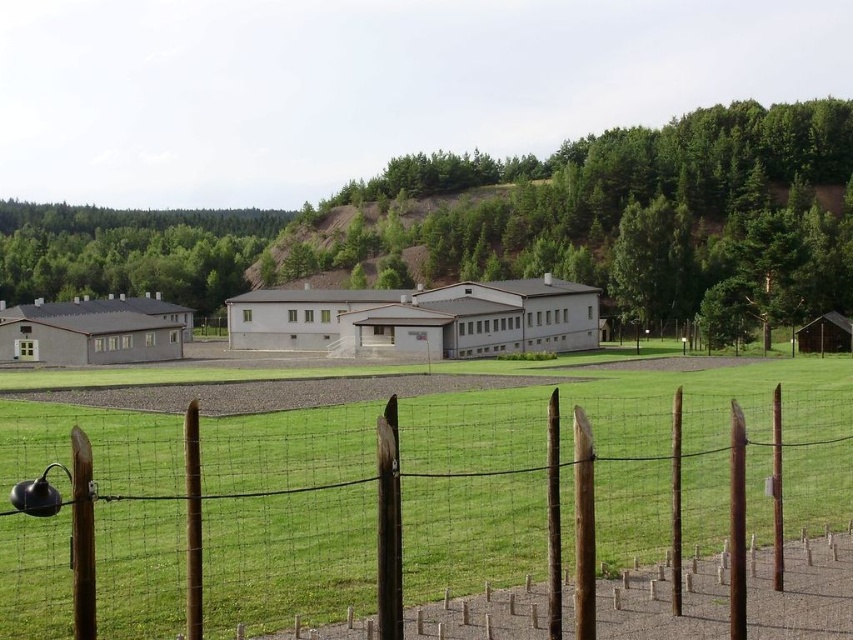
You are a landscape architect planning to install a new bench in the rural landscape. The bench requires a space wider than the white matte building at center. Can the green leafy tree at center provide enough space for the bench?

The green leafy tree at center has a larger width than the white matte building at center, so the space under the tree is wider than required. Therefore, the bench can be placed there.

You are a landscape architect designing a new garden. You need to decide where to place a large statue that requires a significant amount of space. Based on the scene, which object between the brown wooden fence at lower center and the green leafy tree at upper left would you consider for placement, and why?

The green leafy tree at upper left occupies more space than the brown wooden fence at lower center, so placing the large statue near the green leafy tree at upper left would be more appropriate due to the available space.